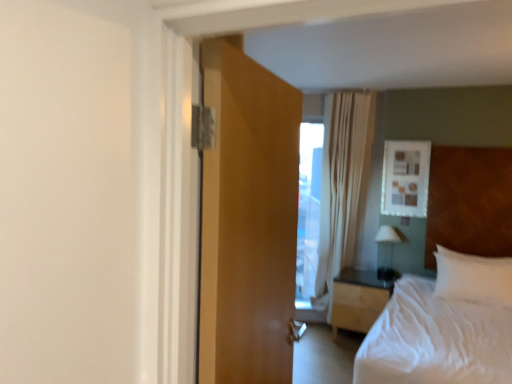
Question: Is wooden door at center placed right next to white soft pillow at right?

Choices:
 (A) yes
 (B) no

Answer: (B)

Question: From the image's perspective, is wooden door at center over white soft pillow at right?

Choices:
 (A) no
 (B) yes

Answer: (B)

Question: Is wooden door at center at the left side of white soft pillow at right?

Choices:
 (A) yes
 (B) no

Answer: (A)

Question: Is wooden door at center oriented towards white soft pillow at right?

Choices:
 (A) yes
 (B) no

Answer: (B)

Question: Can you confirm if wooden door at center is thinner than white soft pillow at right?

Choices:
 (A) no
 (B) yes

Answer: (B)

Question: Can you confirm if wooden door at center is wider than white soft pillow at right?

Choices:
 (A) yes
 (B) no

Answer: (B)

Question: Is light wood/wooden nightstand at center oriented away from white glossy lamp at right?

Choices:
 (A) yes
 (B) no

Answer: (B)

Question: Is light wood/wooden nightstand at center smaller than white glossy lamp at right?

Choices:
 (A) yes
 (B) no

Answer: (B)

Question: Is light wood/wooden nightstand at center far from white glossy lamp at right?

Choices:
 (A) no
 (B) yes

Answer: (A)

Question: From a real-world perspective, is light wood/wooden nightstand at center over white glossy lamp at right?

Choices:
 (A) no
 (B) yes

Answer: (A)

Question: Would you say light wood/wooden nightstand at center is outside white glossy lamp at right?

Choices:
 (A) yes
 (B) no

Answer: (A)

Question: Is light wood/wooden nightstand at center at the right side of white glossy lamp at right?

Choices:
 (A) yes
 (B) no

Answer: (B)

Question: Can you confirm if white sheer curtain at upper center is taller than white glossy lamp at right?

Choices:
 (A) yes
 (B) no

Answer: (A)